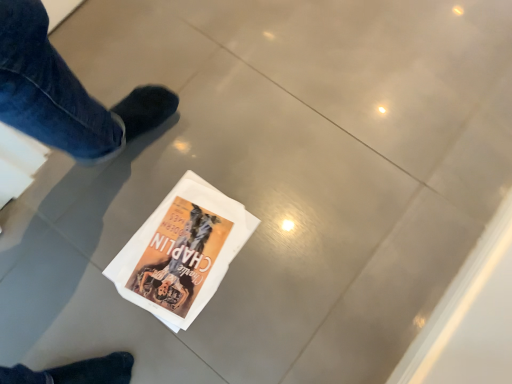
What is the approximate height of white paper at center?

1.07 inches.

Where is `white paper at center`? The height and width of the screenshot is (384, 512). white paper at center is located at coordinates (182, 251).

The image size is (512, 384). Describe the element at coordinates (182, 251) in the screenshot. I see `white paper at center` at that location.

Where is `white paper at center`? The width and height of the screenshot is (512, 384). white paper at center is located at coordinates (182, 251).